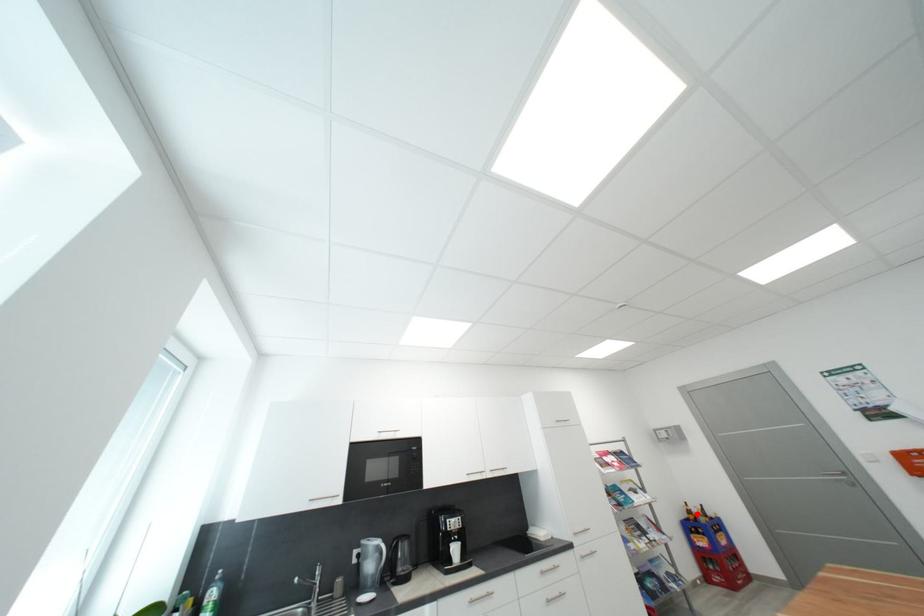
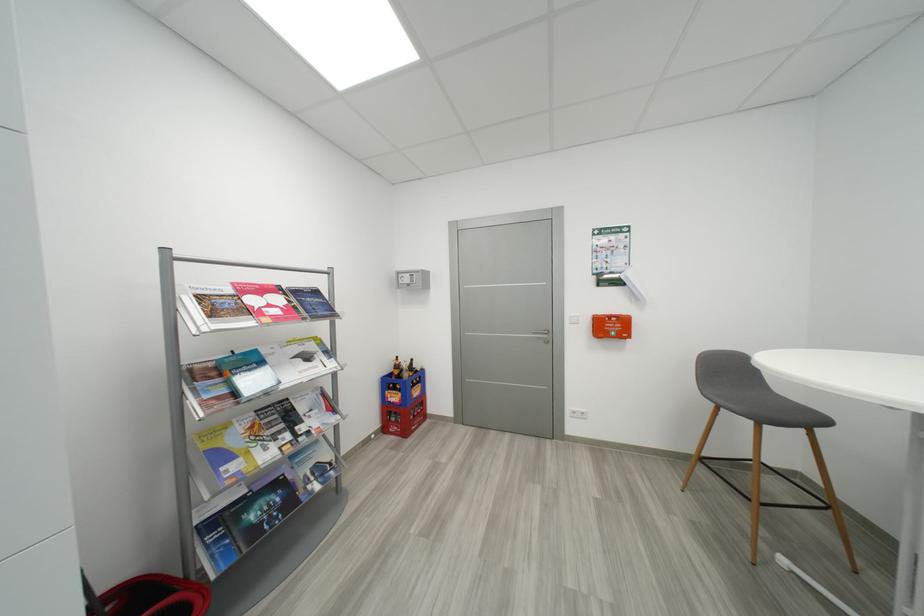
The point at the highlighted location is marked in the first image. Where is the corresponding point in the second image?

(404, 369)